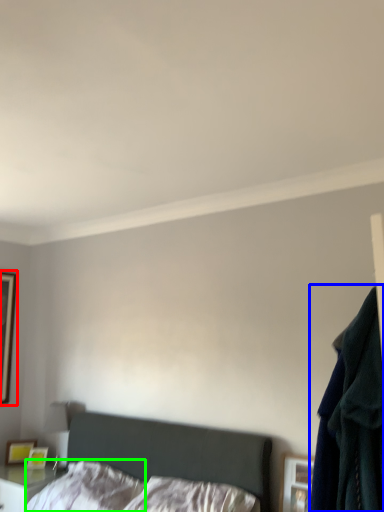
Question: Which is farther away from picture frame (highlighted by a red box)? clothing (highlighted by a blue box) or pillow (highlighted by a green box)?

Choices:
 (A) clothing
 (B) pillow

Answer: (A)